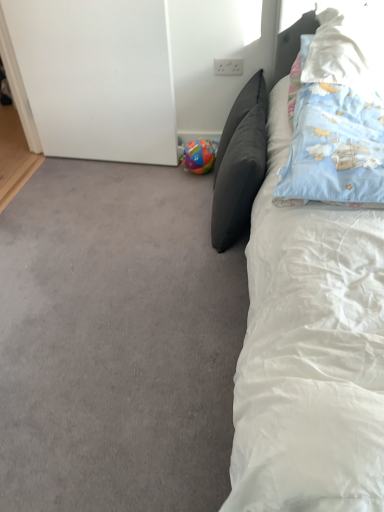
Question: Considering the relative positions of multicolored plastic ball at lower left and gray carpet at lower left in the image provided, is multicolored plastic ball at lower left to the left of gray carpet at lower left from the viewer's perspective?

Choices:
 (A) yes
 (B) no

Answer: (B)

Question: Can you confirm if multicolored plastic ball at lower left is thinner than gray carpet at lower left?

Choices:
 (A) no
 (B) yes

Answer: (B)

Question: Is gray carpet at lower left surrounded by multicolored plastic ball at lower left?

Choices:
 (A) yes
 (B) no

Answer: (B)

Question: Considering the relative sizes of multicolored plastic ball at lower left and gray carpet at lower left in the image provided, is multicolored plastic ball at lower left smaller than gray carpet at lower left?

Choices:
 (A) no
 (B) yes

Answer: (B)

Question: Is multicolored plastic ball at lower left at the right side of gray carpet at lower left?

Choices:
 (A) yes
 (B) no

Answer: (A)

Question: From the image's perspective, is white soft pillow at upper right, the 1th pillow when ordered from right to left, above or below blue cotton pillow at upper right, which is the 2th pillow from right to left?

Choices:
 (A) below
 (B) above

Answer: (B)

Question: Is white soft pillow at upper right, positioned as the 3th pillow in left-to-right order, bigger or smaller than blue cotton pillow at upper right, acting as the second pillow starting from the left?

Choices:
 (A) big
 (B) small

Answer: (B)

Question: Is white soft pillow at upper right, positioned as the 3th pillow in left-to-right order, spatially inside blue cotton pillow at upper right, acting as the second pillow starting from the left, or outside of it?

Choices:
 (A) inside
 (B) outside

Answer: (A)

Question: In terms of height, does white soft pillow at upper right, positioned as the 3th pillow in left-to-right order, look taller or shorter compared to blue cotton pillow at upper right, which is the 2th pillow from right to left?

Choices:
 (A) tall
 (B) short

Answer: (B)

Question: In terms of width, does white soft bed at right look wider or thinner when compared to white soft pillow at upper right, positioned as the 3th pillow in left-to-right order?

Choices:
 (A) thin
 (B) wide

Answer: (B)

Question: Choose the correct answer: Is white soft bed at right inside white soft pillow at upper right, positioned as the 3th pillow in left-to-right order, or outside it?

Choices:
 (A) outside
 (B) inside

Answer: (A)

Question: Would you say white soft bed at right is to the left or to the right of white soft pillow at upper right, positioned as the 3th pillow in left-to-right order, in the picture?

Choices:
 (A) left
 (B) right

Answer: (A)

Question: In terms of height, does white soft bed at right look taller or shorter compared to white soft pillow at upper right, the 1th pillow when ordered from right to left?

Choices:
 (A) tall
 (B) short

Answer: (A)

Question: In terms of width, does dark gray cushion at center, which is counted as the first pillow, starting from the left, look wider or thinner when compared to white soft bed at right?

Choices:
 (A) wide
 (B) thin

Answer: (B)

Question: From a real-world perspective, is dark gray cushion at center, positioned as the third pillow in right-to-left order, above or below white soft bed at right?

Choices:
 (A) below
 (B) above

Answer: (A)